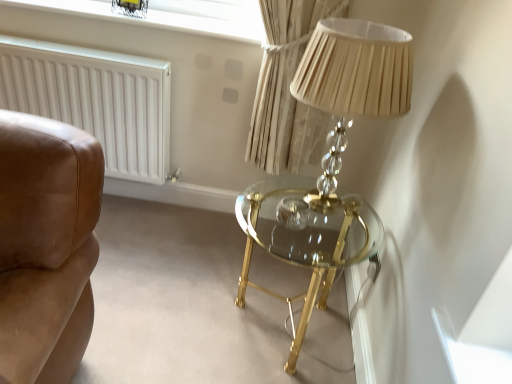
Question: From the image's perspective, is white matte radiator at left on top of gold glass table at center?

Choices:
 (A) no
 (B) yes

Answer: (B)

Question: Is white matte radiator at left facing away from gold glass table at center?

Choices:
 (A) yes
 (B) no

Answer: (B)

Question: Does white matte radiator at left have a greater height compared to gold glass table at center?

Choices:
 (A) no
 (B) yes

Answer: (B)

Question: From a real-world perspective, is white matte radiator at left physically below gold glass table at center?

Choices:
 (A) no
 (B) yes

Answer: (A)

Question: Could you tell me if white matte radiator at left is turned towards gold glass table at center?

Choices:
 (A) yes
 (B) no

Answer: (B)

Question: Does white matte radiator at left touch gold glass table at center?

Choices:
 (A) yes
 (B) no

Answer: (B)

Question: Is white matte radiator at left taller than clear glass window screen at upper center?

Choices:
 (A) yes
 (B) no

Answer: (A)

Question: Is white matte radiator at left not close to clear glass window screen at upper center?

Choices:
 (A) no
 (B) yes

Answer: (A)

Question: From the image's perspective, is white matte radiator at left on clear glass window screen at upper center?

Choices:
 (A) no
 (B) yes

Answer: (A)

Question: From a real-world perspective, is white matte radiator at left positioned under clear glass window screen at upper center based on gravity?

Choices:
 (A) yes
 (B) no

Answer: (A)

Question: Can you confirm if white matte radiator at left is shorter than clear glass window screen at upper center?

Choices:
 (A) no
 (B) yes

Answer: (A)

Question: Can you confirm if white matte radiator at left is positioned to the left of clear glass window screen at upper center?

Choices:
 (A) no
 (B) yes

Answer: (B)

Question: Is clear glass window screen at upper center looking in the opposite direction of white matte radiator at left?

Choices:
 (A) no
 (B) yes

Answer: (A)